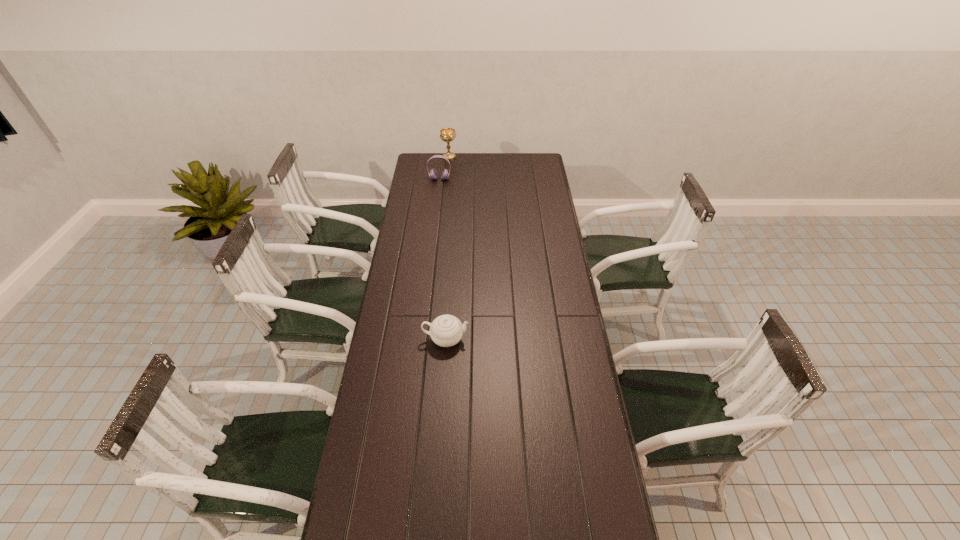
You are a GUI agent. You are given a task and a screenshot of the screen. Output one action in this format:
    pyautogui.click(x=<x>, y=<y>)
    Task: Click on the free spot between the shortest object and the farthest object
    The image size is (960, 540).
    Given the screenshot: What is the action you would take?
    pyautogui.click(x=447, y=248)

Image resolution: width=960 pixels, height=540 pixels. I want to click on vacant area that lies between the farthest object and the headset, so coord(444,168).

This screenshot has height=540, width=960. I want to click on the second closest object relative to the headset, so click(x=446, y=330).

Identify which object is located as the nearest to the chinaware. Please provide its 2D coordinates. Your answer should be formatted as a tuple, i.e. [(x, y)], where the tuple contains the x and y coordinates of a point satisfying the conditions above.

[(433, 174)]